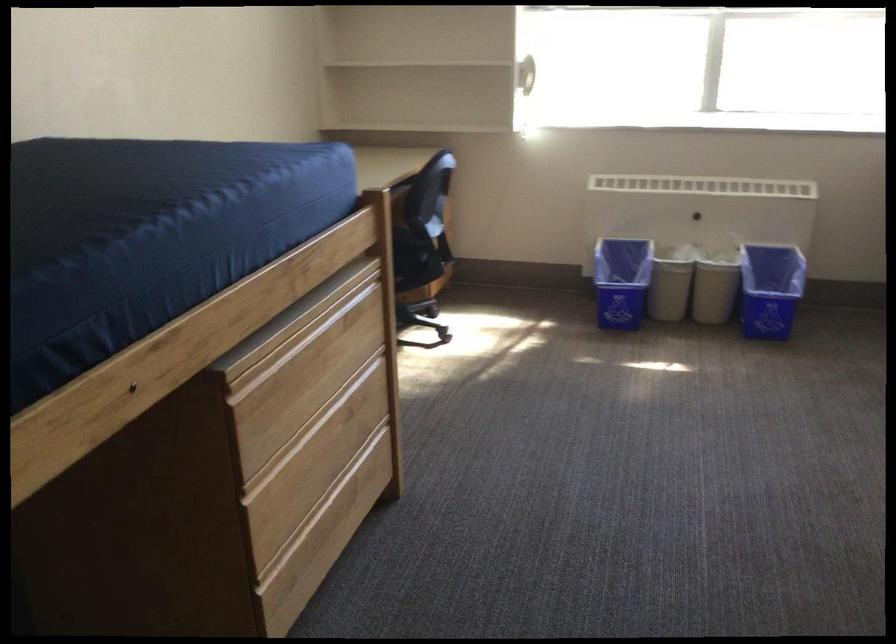
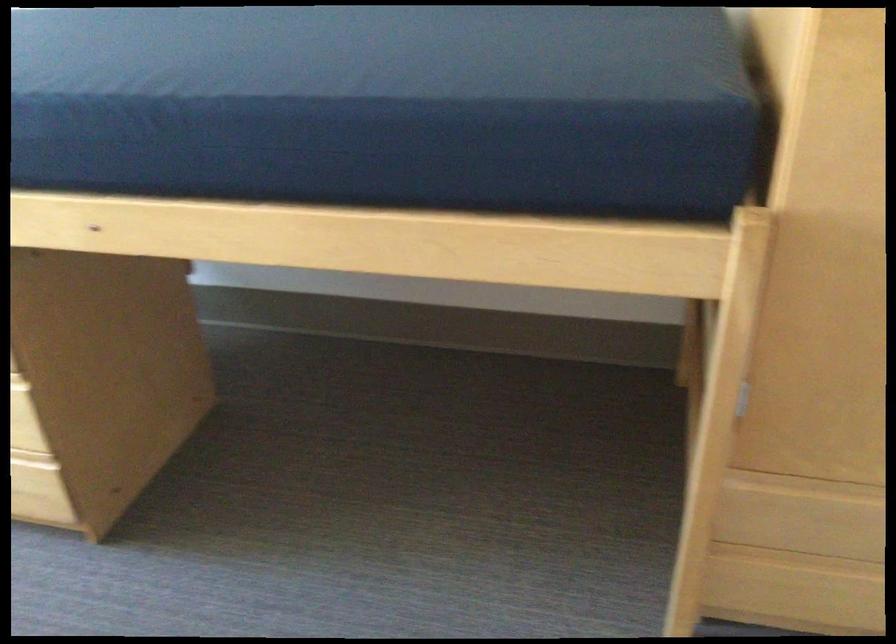
The first image is from the beginning of the video and the second image is from the end. How did the camera likely rotate when shooting the video?

The camera's rotation is toward right-down.